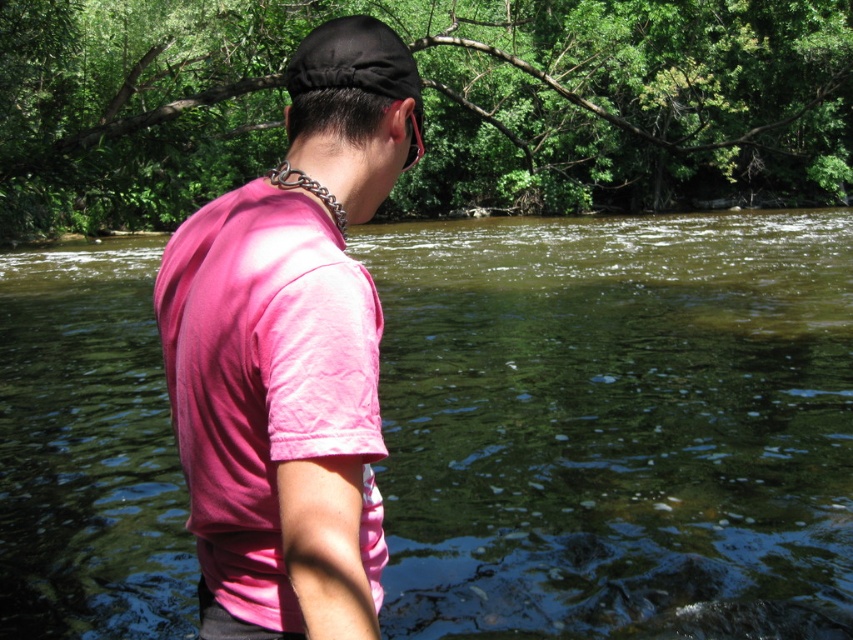
Does clear water at creek center lie in front of pink cotton shirt at center?

No, it is not.

Does clear water at creek center have a lesser height compared to pink cotton shirt at center?

In fact, clear water at creek center may be taller than pink cotton shirt at center.

Which is behind, point (552, 620) or point (363, 20)?

The point (552, 620) is more distant.

Identify the location of clear water at creek center. (616, 424).